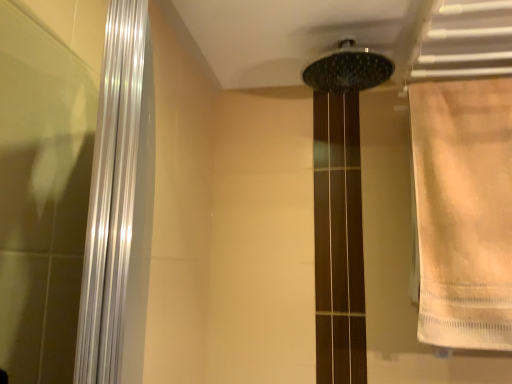
Question: Is beige fabric towel at right inside the boundaries of black matte shower head at upper center, or outside?

Choices:
 (A) outside
 (B) inside

Answer: (A)

Question: Looking at their shapes, would you say beige fabric towel at right is wider or thinner than black matte shower head at upper center?

Choices:
 (A) wide
 (B) thin

Answer: (B)

Question: From the image's perspective, relative to black matte shower head at upper center, is beige fabric towel at right above or below?

Choices:
 (A) below
 (B) above

Answer: (A)

Question: From the image's perspective, relative to beige fabric towel at right, is black matte shower head at upper center above or below?

Choices:
 (A) below
 (B) above

Answer: (B)

Question: Is black matte shower head at upper center taller or shorter than beige fabric towel at right?

Choices:
 (A) tall
 (B) short

Answer: (B)

Question: Would you say black matte shower head at upper center is to the left or to the right of beige fabric towel at right in the picture?

Choices:
 (A) right
 (B) left

Answer: (B)

Question: From a real-world perspective, is black matte shower head at upper center physically located above or below beige fabric towel at right?

Choices:
 (A) below
 (B) above

Answer: (B)